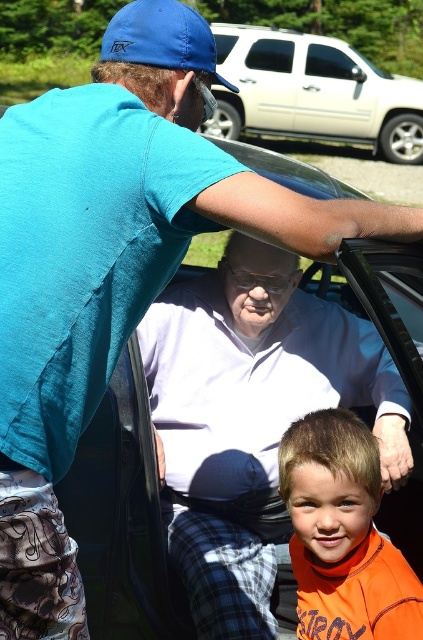
Between orange fleece at lower right and white matte suv at upper center, which one is positioned lower?

orange fleece at lower right is lower down.

Is orange fleece at lower right taller than white matte suv at upper center?

Incorrect, orange fleece at lower right's height is not larger of white matte suv at upper center's.

Is point (315, 557) less distant than point (261, 106)?

Yes, it is.

Find the location of a particular element. orange fleece at lower right is located at coordinates (343, 534).

Looking at this image, how distant is matte black car at center from transparent glass window at center?

They are 13.06 meters apart.

How far apart are matte black car at center and transparent glass window at center?

A distance of 42.85 feet exists between matte black car at center and transparent glass window at center.

Does point (274, 161) come in front of point (250, 56)?

Yes, point (274, 161) is in front of point (250, 56).

The width and height of the screenshot is (423, 640). Find the location of `matte black car at center`. matte black car at center is located at coordinates (123, 516).

Between orange fleece at lower right and white matte car door at upper center, which one is positioned lower?

orange fleece at lower right

Who is more forward, (x=392, y=576) or (x=340, y=99)?

Positioned in front is point (x=392, y=576).

Identify the location of orange fleece at lower right. This screenshot has height=640, width=423. (343, 534).